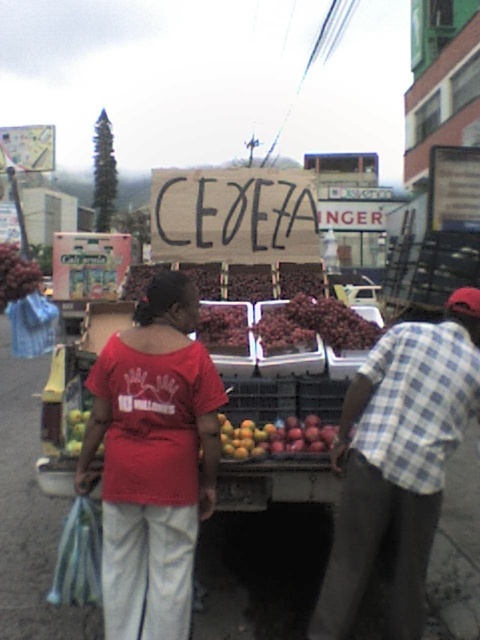
You are taking a photo of the vendor stall with your phone. You notice two points in the image labeled as point 1 and point 2. The first point is at coordinate [90,477] and the second is at [242,340]. Which point will appear larger in your photo?

Point 1 at coordinate [90,477] will appear larger in the photo because it is closer to the camera than point 2 at [242,340].

You are a customer at the market and want to buy the ripe red grapes at center. The vendor is wearing a blue checkered shirt at center. Which direction should you move to approach the grapes from the vendor?

The blue checkered shirt at center is to the right of the ripe red grapes at center, so you should move to the left to approach the grapes from the vendor.

You are a photographer trying to capture both the matte red shirt at center and the blue checkered shirt at center in a single frame. Given their sizes in the image, which one would you need to position closer to the camera to ensure both fit in the frame?

Since the matte red shirt at center occupies less space than the blue checkered shirt at center, you would need to position the blue checkered shirt at center closer to the camera to ensure both fit in the frame.